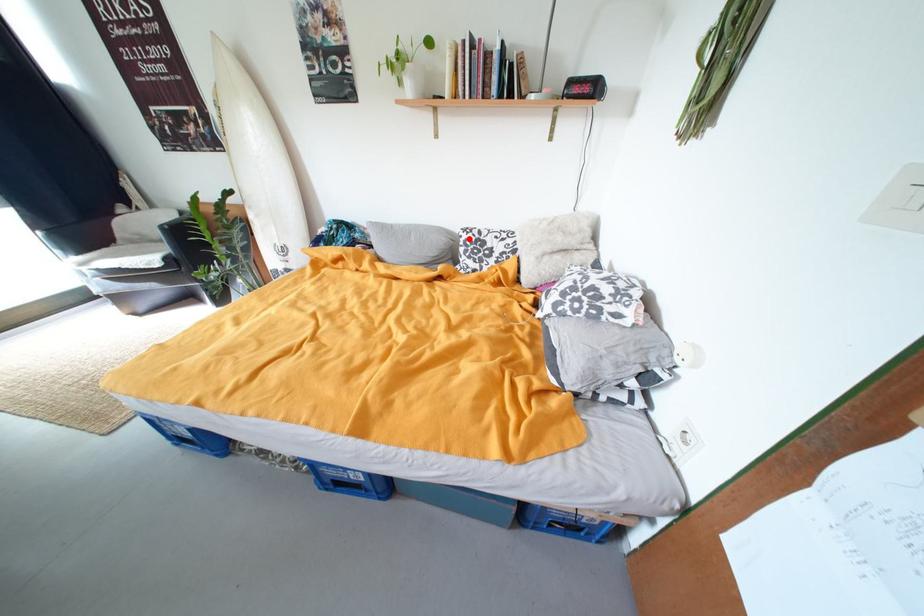
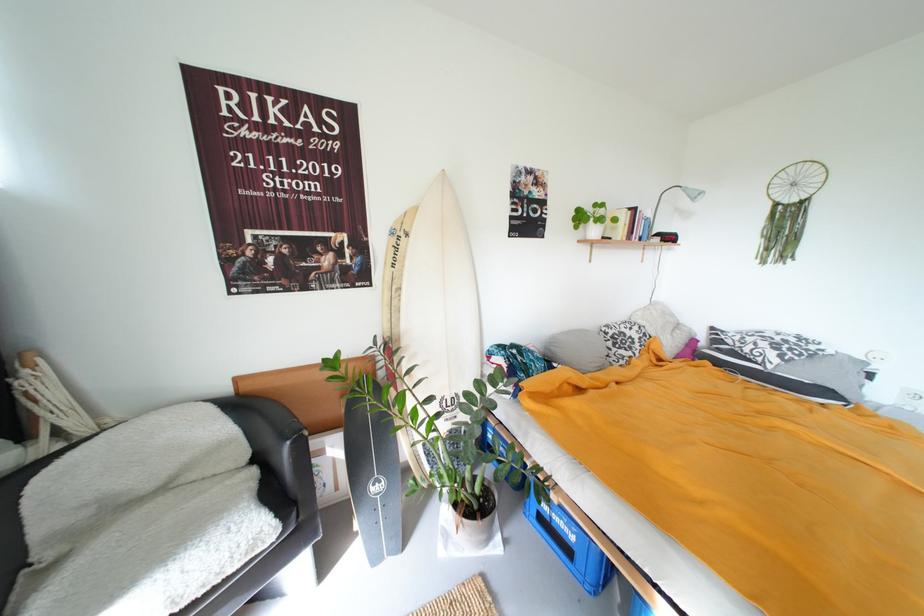
Question: I am providing you with two images of the same scene from different viewpoints. In image1, a red point is highlighted. Considering the same 3D point in image2, which of the following is correct?

Choices:
 (A) It is closer
 (B) It is farther

Answer: (B)